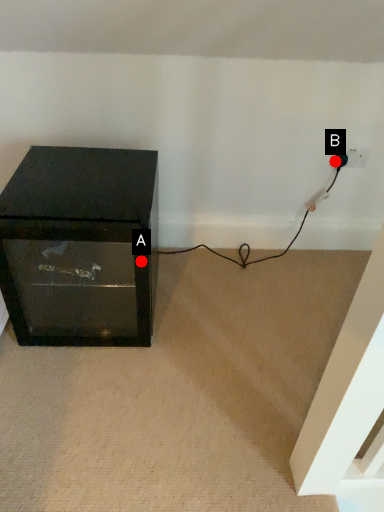
Question: Two points are circled on the image, labeled by A and B beside each circle. Which point appears farthest from the camera in this image?

Choices:
 (A) A is further
 (B) B is further

Answer: (B)